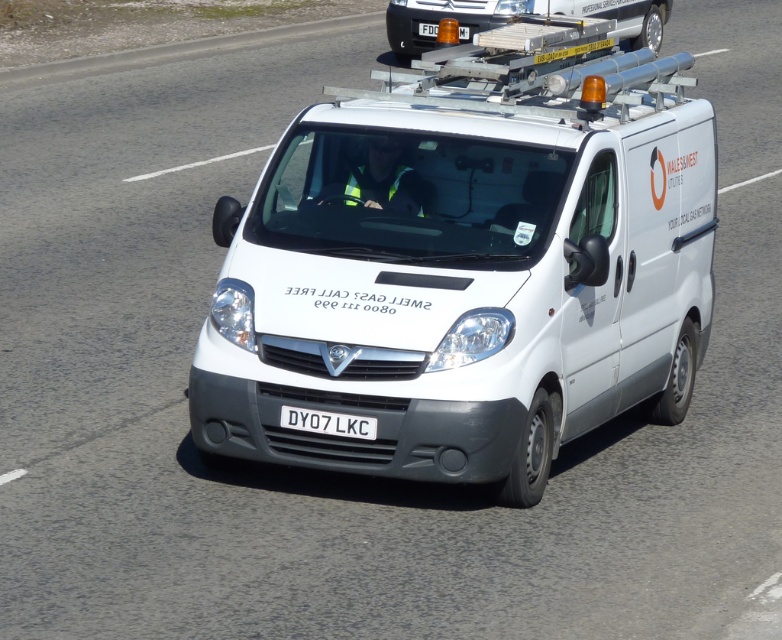
You are a delivery person who needs to park the white matte van at center in a parking spot that is exactly the same width as the van. The parking spot has a white plastic license plate at center attached to its entrance. Can the van fit perfectly into the parking spot without any overhang?

The white matte van at center might be wider than the white plastic license plate at center, so there is a possibility that the van will not fit perfectly into the parking spot and may have an overhang.

You are a traffic officer observing two vans on the road. You notice a white matte van at center and a white metallic van at center. Which van could potentially block the narrow lane more due to its width?

The white matte van at center might be wider than the white metallic van at center, so it could potentially block the narrow lane more due to its width.